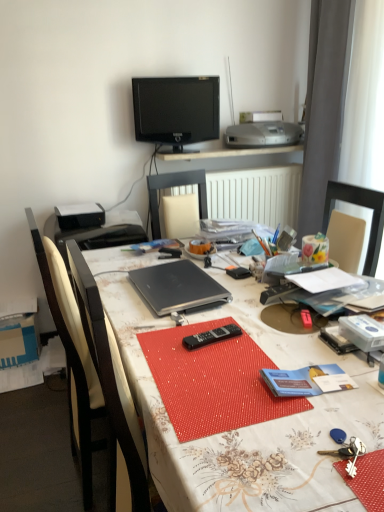
The width and height of the screenshot is (384, 512). I want to click on vacant space to the right of black matte laptop at center, so click(256, 300).